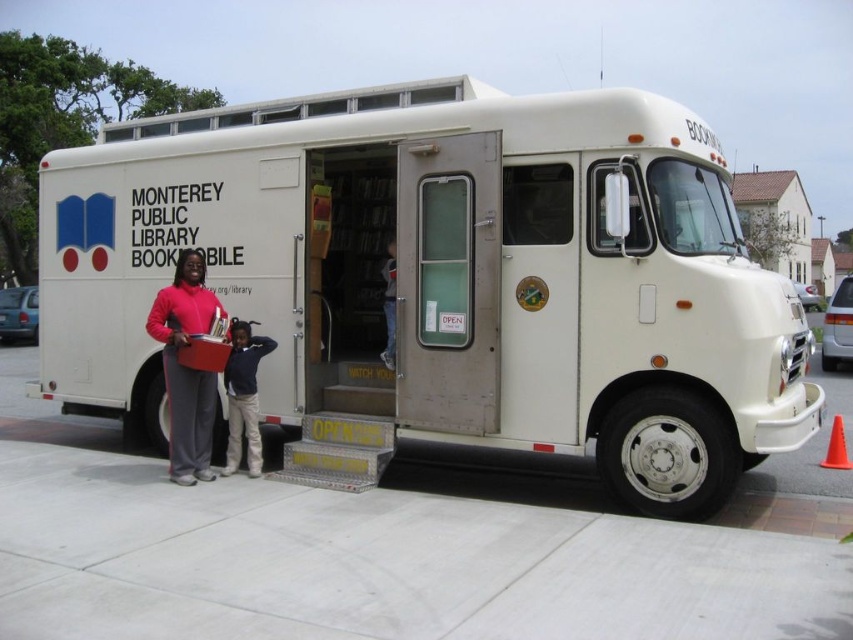
Who is positioned more to the left, matte pink sweater at center or dark blue sweater at center?

Positioned to the left is matte pink sweater at center.

The height and width of the screenshot is (640, 853). What do you see at coordinates (186, 365) in the screenshot?
I see `matte pink sweater at center` at bounding box center [186, 365].

Locate an element on the screen. matte pink sweater at center is located at coordinates (186, 365).

What do you see at coordinates (442, 284) in the screenshot? This screenshot has height=640, width=853. I see `white matte bookmobile at center` at bounding box center [442, 284].

Image resolution: width=853 pixels, height=640 pixels. I want to click on white matte bookmobile at center, so point(442,284).

In the scene shown: Is white matte bookmobile at center further to camera compared to dark blue sweater at center?

Yes.

Is white matte bookmobile at center shorter than dark blue sweater at center?

Indeed, white matte bookmobile at center has a lesser height compared to dark blue sweater at center.

I want to click on white matte bookmobile at center, so pos(442,284).

Identify the location of white matte bookmobile at center. The width and height of the screenshot is (853, 640). (442, 284).